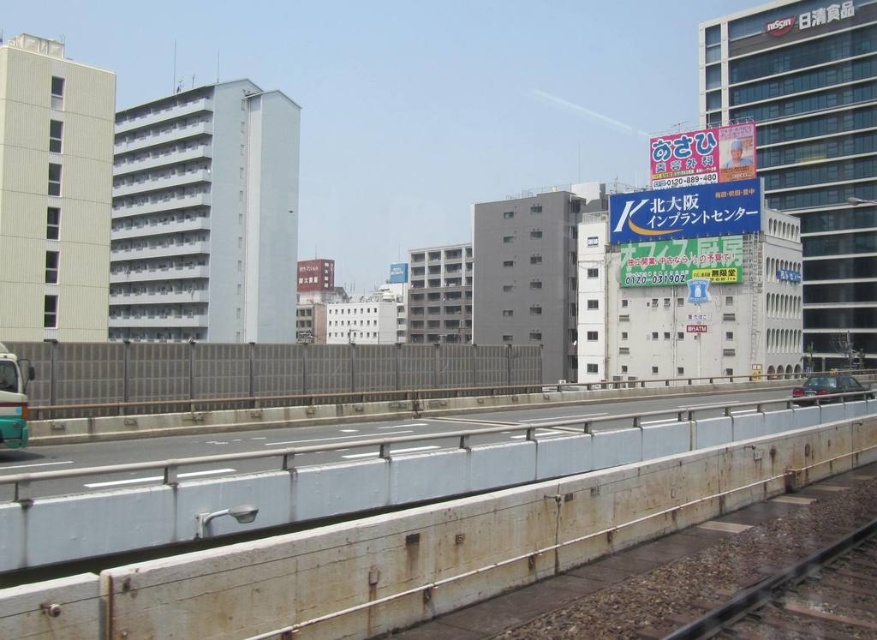
Question: Does brown wooden train track at lower right have a lesser width compared to teal matte bus at left?

Choices:
 (A) no
 (B) yes

Answer: (A)

Question: Does brown wooden train track at lower right have a greater width compared to teal matte bus at left?

Choices:
 (A) yes
 (B) no

Answer: (A)

Question: Is brown wooden train track at lower right above teal matte bus at left?

Choices:
 (A) yes
 (B) no

Answer: (B)

Question: Which object appears farthest from the camera in this image?

Choices:
 (A) teal matte bus at left
 (B) brown wooden train track at lower right

Answer: (A)

Question: Which point appears closest to the camera in this image?

Choices:
 (A) (824, 556)
 (B) (18, 420)

Answer: (A)

Question: Which of the following is the farthest from the observer?

Choices:
 (A) metallic silver car at right
 (B) brown wooden train track at lower right

Answer: (A)